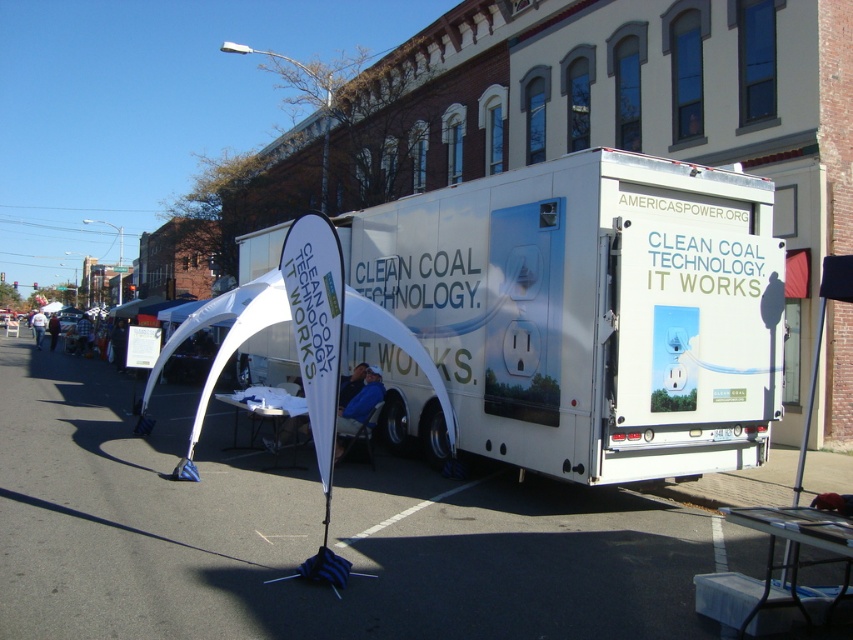
You are standing at the origin point of the coordinate system. The white vinyl trailer at center is located at coordinates 0.487, 0.694. If you want to walk directly towards the trailer, in which direction should you head?

You should head towards the northeast direction since the white vinyl trailer at center is located at coordinates [590,310], which is northeast of the origin point.

You are standing at the event and see two points marked in the image. The first point is labeled as point (585,161) and the second is point (140,355). According to the scene description, which point is closer to you?

Point (585,161) is in front of point (140,355), so it is closer to you.

You are a city planner assessing the space requirements for an upcoming event. The white vinyl trailer at center and the white paper at center are both part of the setup. Given their sizes, which object would require more storage space when not in use?

The white paper at center requires more storage space because it has a larger size compared to the white vinyl trailer at center.